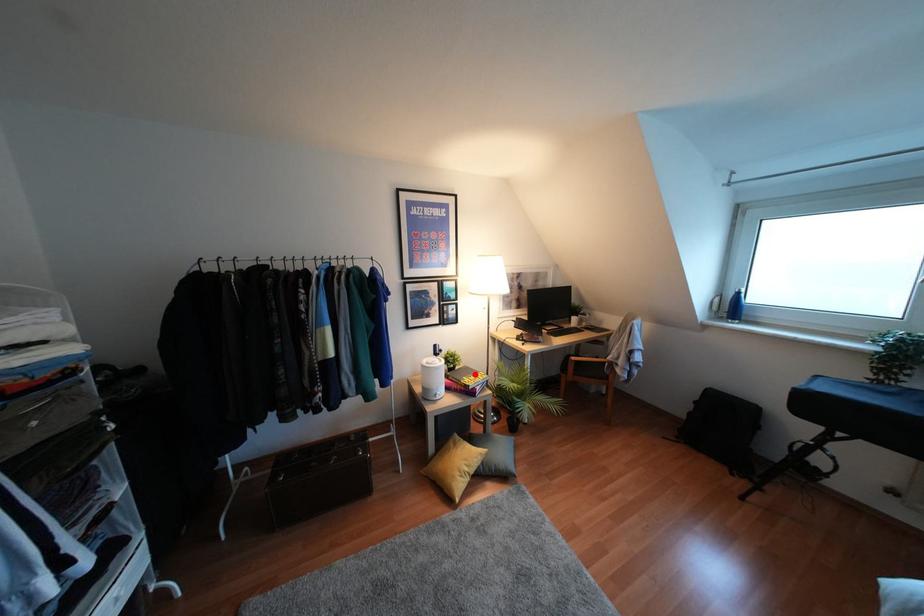
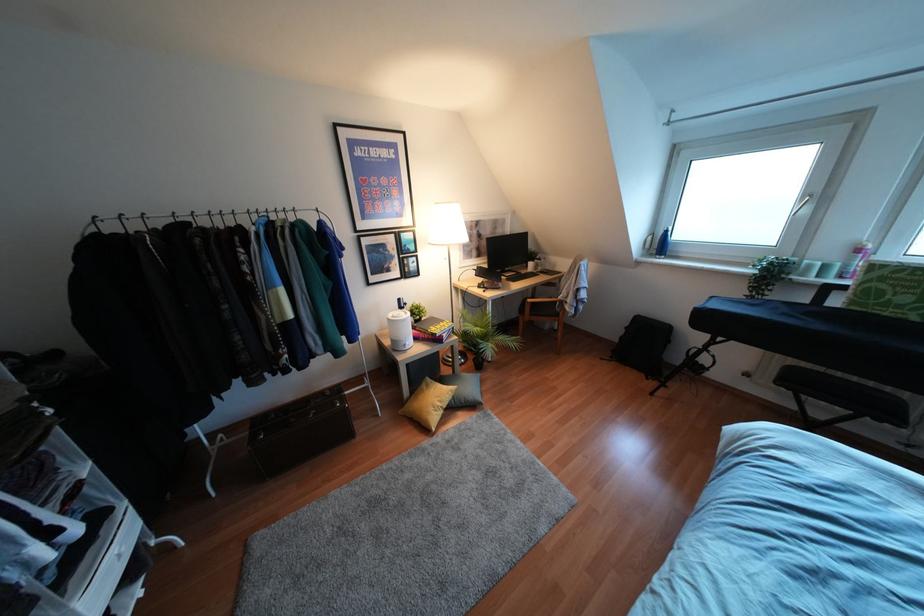
Find the pixel in the second image that matches the highlighted location in the first image.

(441, 323)